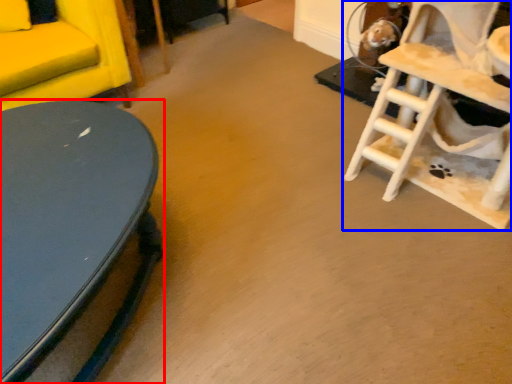
Question: Which point is further to the camera, table (highlighted by a red box) or rocking chair (highlighted by a blue box)?

Choices:
 (A) table
 (B) rocking chair

Answer: (B)